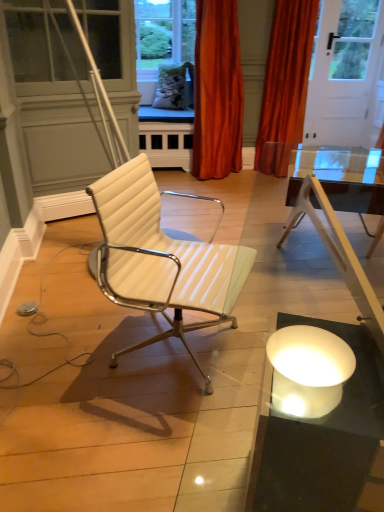
The image size is (384, 512). Identify the location of free region under white leather chair at center (from a real-world perspective). (173, 340).